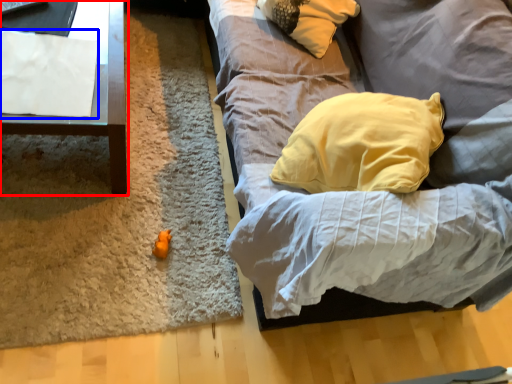
Question: Which point is closer to the camera, furniture (highlighted by a red box) or sheet (highlighted by a blue box)?

Choices:
 (A) furniture
 (B) sheet

Answer: (A)